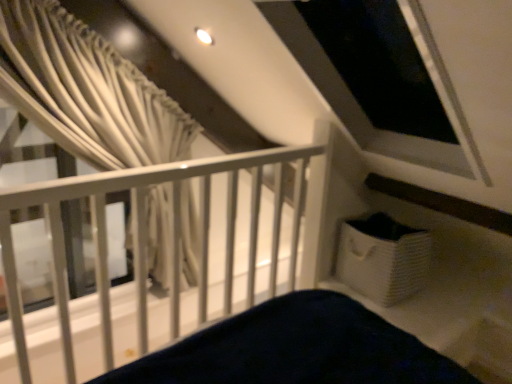
Where is `white matte rail at upper left`? white matte rail at upper left is located at coordinates (145, 236).

The width and height of the screenshot is (512, 384). What do you see at coordinates (145, 236) in the screenshot?
I see `white matte rail at upper left` at bounding box center [145, 236].

What do you see at coordinates (86, 90) in the screenshot? I see `white fabric curtain at upper left` at bounding box center [86, 90].

At what (x,y) coordinates should I click in order to perform the action: click on white fabric curtain at upper left. Please return your answer as a coordinate pair (x, y). The width and height of the screenshot is (512, 384). Looking at the image, I should click on [x=86, y=90].

This screenshot has width=512, height=384. I want to click on white matte rail at upper left, so click(145, 236).

Between white matte rail at upper left and white fabric curtain at upper left, which one appears on the right side from the viewer's perspective?

white matte rail at upper left is more to the right.

Is white matte rail at upper left behind white fabric curtain at upper left?

No, it is in front of white fabric curtain at upper left.

Considering the points (230, 309) and (51, 50), which point is in front, point (230, 309) or point (51, 50)?

The point (51, 50) is more forward.

From the image's perspective, is white matte rail at upper left located beneath white fabric curtain at upper left?

Yes, from the image's perspective, white matte rail at upper left is below white fabric curtain at upper left.

From a real-world perspective, between white matte rail at upper left and white fabric curtain at upper left, who is vertically higher?

In real-world perspective, white fabric curtain at upper left is above.

Based on the photo, in terms of width, does white matte rail at upper left look wider or thinner when compared to white fabric curtain at upper left?

In the image, white matte rail at upper left appears to be wider than white fabric curtain at upper left.

Considering the sizes of objects white matte rail at upper left and white fabric curtain at upper left in the image provided, who is taller, white matte rail at upper left or white fabric curtain at upper left?

white matte rail at upper left is taller.

Considering the sizes of objects white matte rail at upper left and white fabric curtain at upper left in the image provided, who is smaller, white matte rail at upper left or white fabric curtain at upper left?

white fabric curtain at upper left is smaller.

Is white matte rail at upper left surrounding white fabric curtain at upper left?

No, white matte rail at upper left does not contain white fabric curtain at upper left.

Are white matte rail at upper left and white fabric curtain at upper left beside each other?

white matte rail at upper left and white fabric curtain at upper left are not in contact.

Is white matte rail at upper left aimed at white fabric curtain at upper left?

No.

What's the angular difference between white matte rail at upper left and white fabric curtain at upper left's facing directions?

The facing directions of white matte rail at upper left and white fabric curtain at upper left are 7.54 degrees apart.

Locate an element on the screen. The image size is (512, 384). rail on the right side of white fabric curtain at upper left is located at coordinates (145, 236).

Which object is positioned more to the right, white fabric curtain at upper left or white matte rail at upper left?

From the viewer's perspective, white matte rail at upper left appears more on the right side.

Considering the relative positions of white fabric curtain at upper left and white matte rail at upper left in the image provided, is white fabric curtain at upper left behind white matte rail at upper left?

That is True.

Does point (157, 128) come in front of point (78, 184)?

No, it is behind (78, 184).

From the image's perspective, which one is positioned higher, white fabric curtain at upper left or white matte rail at upper left?

white fabric curtain at upper left is shown above in the image.

From a real-world perspective, is white fabric curtain at upper left under white matte rail at upper left?

No, from a real-world perspective, white fabric curtain at upper left is not beneath white matte rail at upper left.

Considering the sizes of objects white fabric curtain at upper left and white matte rail at upper left in the image provided, who is thinner, white fabric curtain at upper left or white matte rail at upper left?

white fabric curtain at upper left.

Who is shorter, white fabric curtain at upper left or white matte rail at upper left?

white fabric curtain at upper left is shorter.

Considering the sizes of objects white fabric curtain at upper left and white matte rail at upper left in the image provided, who is bigger, white fabric curtain at upper left or white matte rail at upper left?

white matte rail at upper left.

Would you say white matte rail at upper left is part of white fabric curtain at upper left's contents?

Definitely not — white matte rail at upper left is not inside white fabric curtain at upper left.

Is white fabric curtain at upper left directly adjacent to white matte rail at upper left?

white fabric curtain at upper left is not next to white matte rail at upper left, and they're not touching.

Could you tell me if white fabric curtain at upper left is turned towards white matte rail at upper left?

No, white fabric curtain at upper left does not turn towards white matte rail at upper left.

What's the angular difference between white fabric curtain at upper left and white matte rail at upper left's facing directions?

white fabric curtain at upper left and white matte rail at upper left are facing 7.54 degrees away from each other.

This screenshot has width=512, height=384. Identify the location of curtain above the white matte rail at upper left (from a real-world perspective). (86, 90).

Identify the location of rail on the right of white fabric curtain at upper left. This screenshot has width=512, height=384. (145, 236).

Find the location of a particular element. curtain on the left side of white matte rail at upper left is located at coordinates (86, 90).